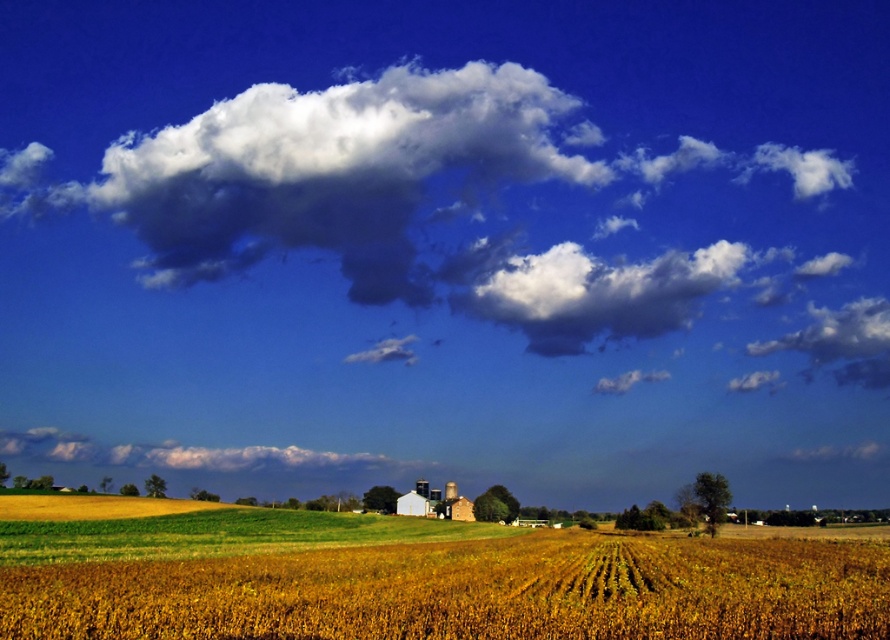
Between point (554, 337) and point (45, 460), which one is positioned behind?

Point (45, 460)

Can you confirm if white fluffy cloud at upper center is positioned to the right of white fluffy cloud at lower center?

Yes, white fluffy cloud at upper center is to the right of white fluffy cloud at lower center.

Locate an element on the screen. The image size is (890, 640). white fluffy cloud at upper center is located at coordinates (596, 294).

Does yellow matte wheat field at center have a larger size compared to white fluffy cloud at lower center?

Indeed, yellow matte wheat field at center has a larger size compared to white fluffy cloud at lower center.

Does yellow matte wheat field at center appear on the left side of white fluffy cloud at lower center?

Incorrect, yellow matte wheat field at center is not on the left side of white fluffy cloud at lower center.

Is point (270, 566) more distant than point (39, 432)?

No.

I want to click on yellow matte wheat field at center, so click(471, 592).

Can you confirm if yellow matte wheat field at center is shorter than white fluffy cloud at upper center?

Correct, yellow matte wheat field at center is not as tall as white fluffy cloud at upper center.

Between yellow matte wheat field at center and white fluffy cloud at upper center, which one appears on the left side from the viewer's perspective?

yellow matte wheat field at center

Who is more forward, (279, 595) or (524, 262)?

Point (279, 595) is more forward.

Identify the location of yellow matte wheat field at center. The image size is (890, 640). (471, 592).